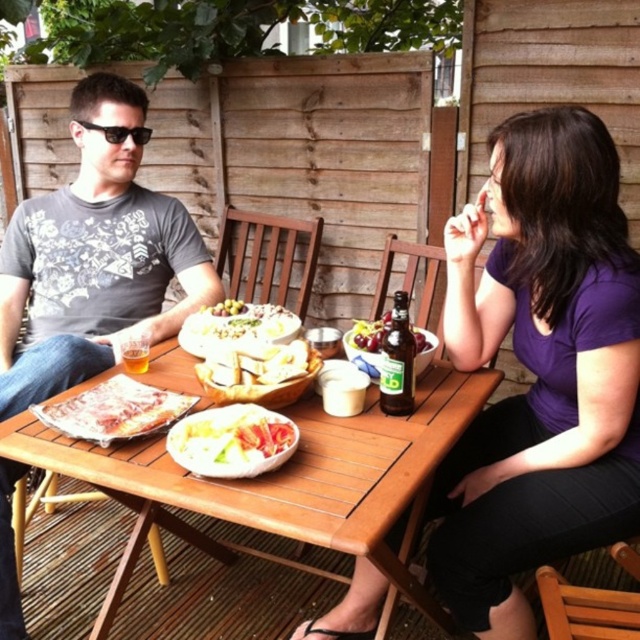
Consider the image. You are a guest at this outdoor dining event and want to reach for the golden crispy pizza at center. Since you are sitting at the wooden table at center, which object is closer to you when you extend your arm?

The wooden table at center is closer to you than the golden crispy pizza at center because the wooden table at center is in front of the golden crispy pizza at center.